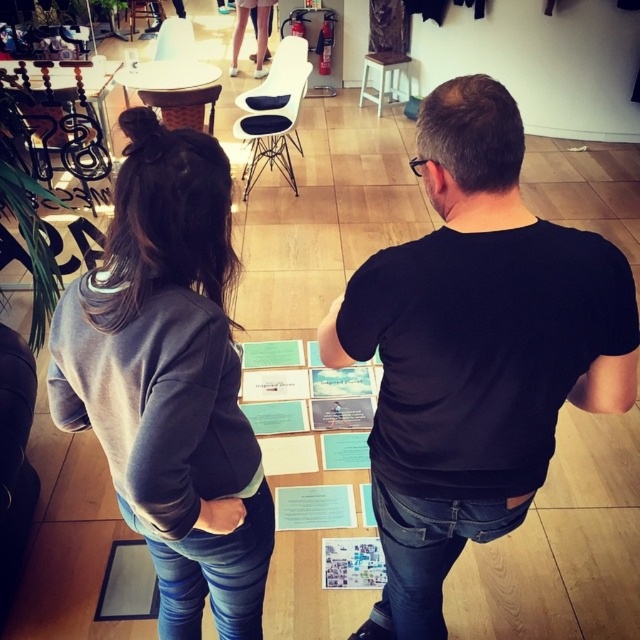
Looking at this image, is black matte shirt at center shorter than gray fleece sweatshirt at left?

In fact, black matte shirt at center may be taller than gray fleece sweatshirt at left.

Describe the element at coordinates (474, 349) in the screenshot. I see `black matte shirt at center` at that location.

Which is behind, point (468, 236) or point (124, 403)?

The point (124, 403) is more distant.

Locate an element on the screen. Image resolution: width=640 pixels, height=640 pixels. black matte shirt at center is located at coordinates (474, 349).

Which of these two, gray fleece sweatshirt at left or white plastic stool at upper center, stands shorter?

With less height is white plastic stool at upper center.

At what (x,y) coordinates should I click in order to perform the action: click on gray fleece sweatshirt at left. Please return your answer as a coordinate pair (x, y). The width and height of the screenshot is (640, 640). Looking at the image, I should click on (170, 380).

Which of these two, black matte shirt at center or white plastic stool at upper center, stands taller?

Standing taller between the two is black matte shirt at center.

Can you confirm if black matte shirt at center is positioned to the right of white plastic stool at upper center?

In fact, black matte shirt at center is to the left of white plastic stool at upper center.

Does point (321, 344) come farther from viewer compared to point (364, 61)?

No, it is not.

At what (x,y) coordinates should I click in order to perform the action: click on black matte shirt at center. Please return your answer as a coordinate pair (x, y). This screenshot has height=640, width=640. Looking at the image, I should click on (474, 349).